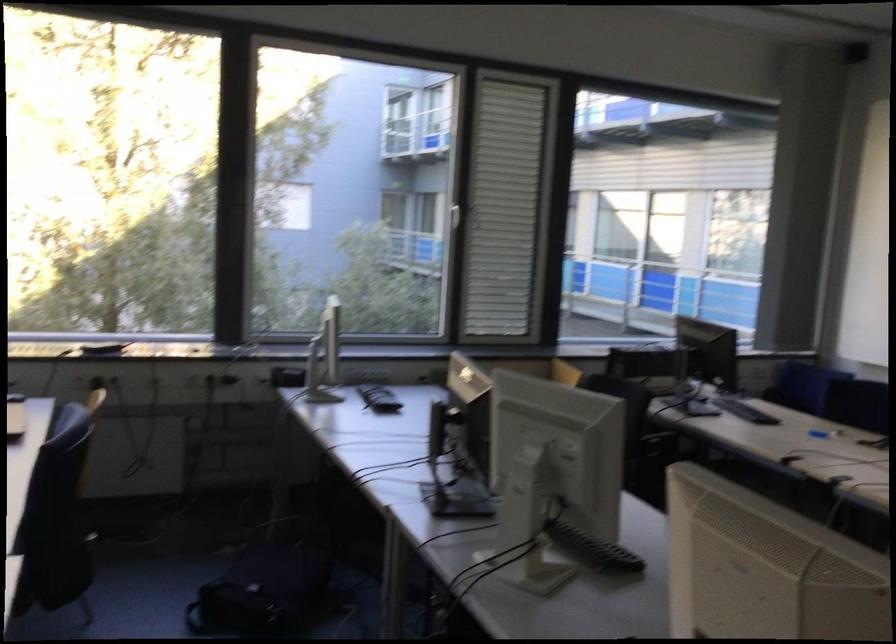
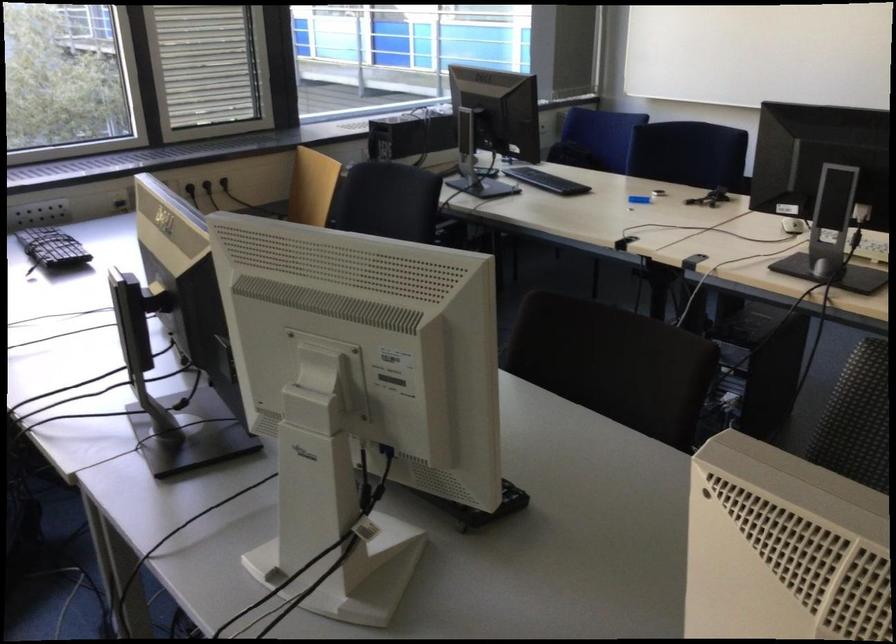
Question: Which direction would the cameraman need to move to produce the second image? Reply with the corresponding letter.

Choices:
 (A) Left
 (B) Right
 (C) Forward
 (D) Backward

Answer: (C)